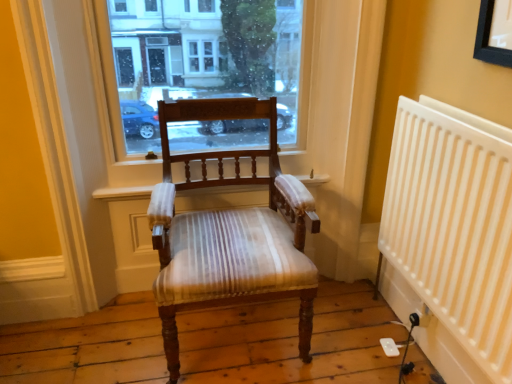
Question: Considering the relative sizes of transparent glass window at center and white plastic radiator at right in the image provided, is transparent glass window at center wider than white plastic radiator at right?

Choices:
 (A) no
 (B) yes

Answer: (B)

Question: Considering the relative positions of transparent glass window at center and white plastic radiator at right in the image provided, is transparent glass window at center to the right of white plastic radiator at right from the viewer's perspective?

Choices:
 (A) yes
 (B) no

Answer: (B)

Question: Is transparent glass window at center facing towards white plastic radiator at right?

Choices:
 (A) no
 (B) yes

Answer: (B)

Question: Considering the relative sizes of transparent glass window at center and white plastic radiator at right in the image provided, is transparent glass window at center taller than white plastic radiator at right?

Choices:
 (A) yes
 (B) no

Answer: (B)

Question: From a real-world perspective, is transparent glass window at center on top of white plastic radiator at right?

Choices:
 (A) no
 (B) yes

Answer: (B)

Question: Looking at the image, does transparent glass window at center seem bigger or smaller compared to white plastic radiator at right?

Choices:
 (A) big
 (B) small

Answer: (B)

Question: Is transparent glass window at center taller or shorter than white plastic radiator at right?

Choices:
 (A) tall
 (B) short

Answer: (B)

Question: From the image's perspective, relative to white plastic radiator at right, is transparent glass window at center above or below?

Choices:
 (A) below
 (B) above

Answer: (B)

Question: Looking at their shapes, would you say transparent glass window at center is wider or thinner than white plastic radiator at right?

Choices:
 (A) wide
 (B) thin

Answer: (A)

Question: In terms of height, does wooden chair with striped upholstery at center look taller or shorter compared to white plastic radiator at right?

Choices:
 (A) tall
 (B) short

Answer: (B)

Question: Considering their positions, is wooden chair with striped upholstery at center located in front of or behind white plastic radiator at right?

Choices:
 (A) behind
 (B) front

Answer: (A)

Question: Does point (209, 281) appear closer or farther from the camera than point (481, 309)?

Choices:
 (A) closer
 (B) farther

Answer: (B)

Question: From a real-world perspective, is wooden chair with striped upholstery at center physically located above or below white plastic radiator at right?

Choices:
 (A) above
 (B) below

Answer: (B)

Question: Is white plastic radiator at right inside or outside of wooden chair with striped upholstery at center?

Choices:
 (A) inside
 (B) outside

Answer: (B)

Question: From the image's perspective, is white plastic radiator at right located above or below wooden chair with striped upholstery at center?

Choices:
 (A) above
 (B) below

Answer: (B)